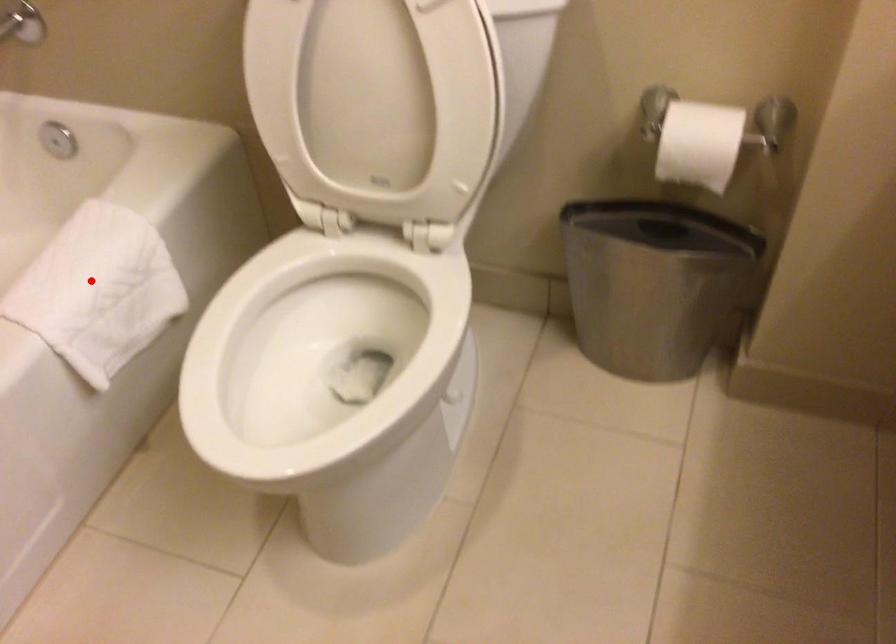
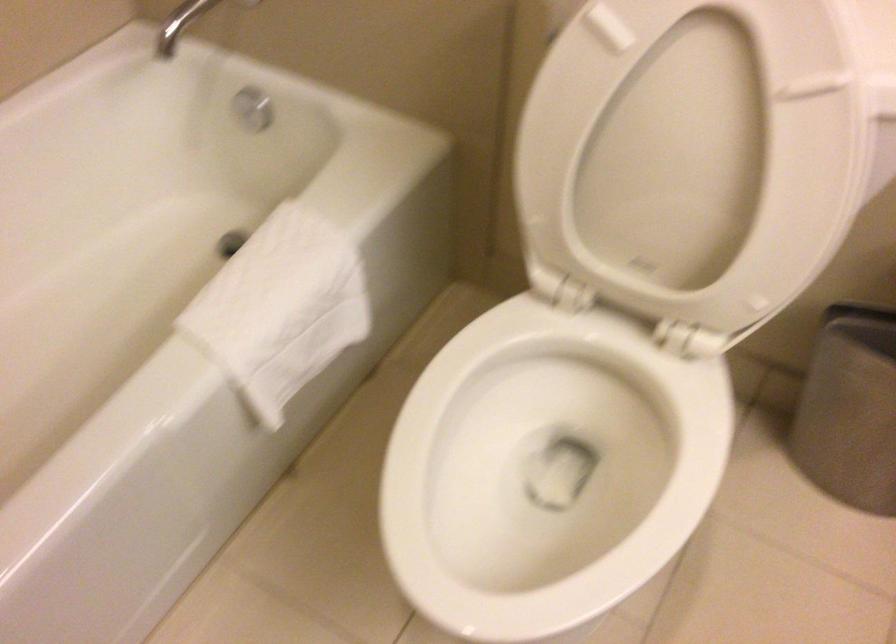
Where in the second image is the point corresponding to the highlighted location from the first image?

(282, 303)